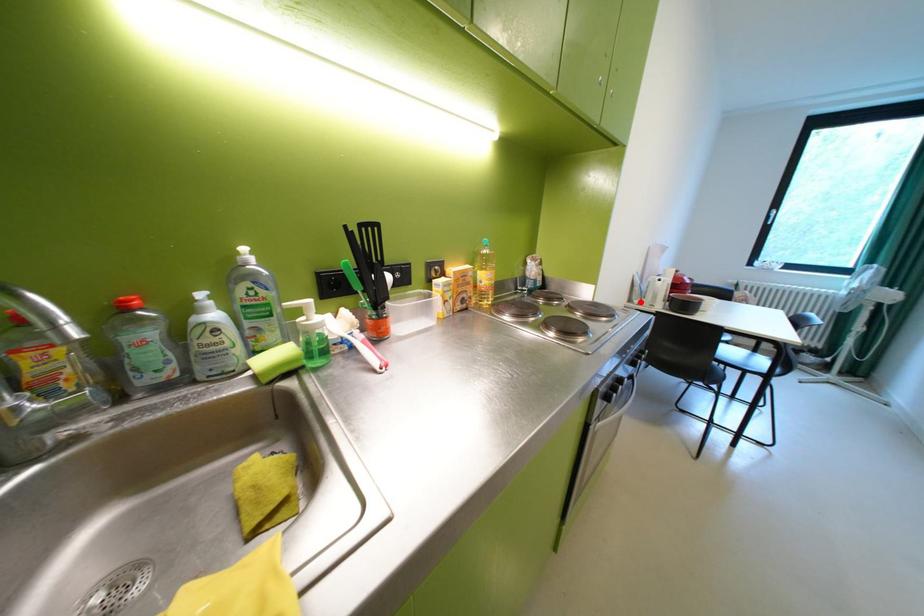
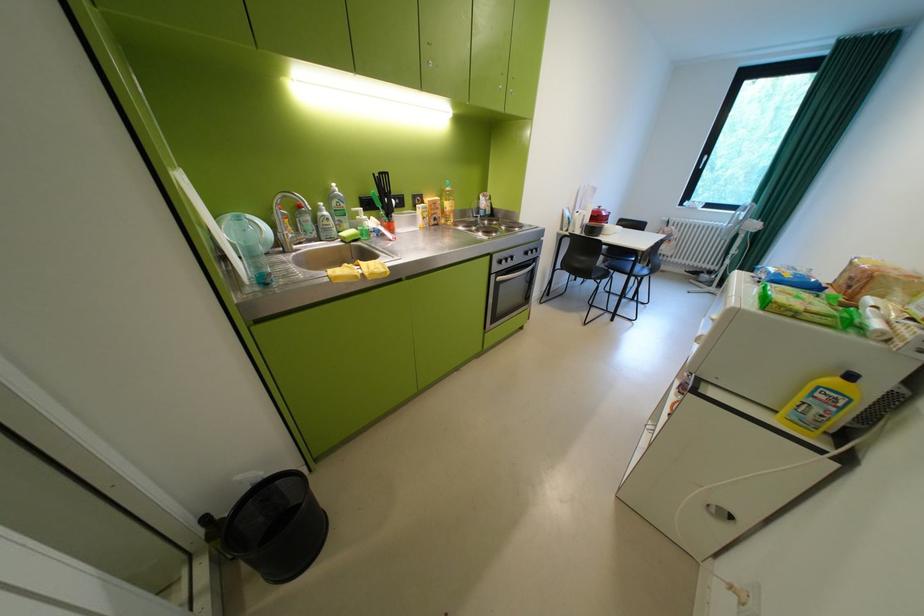
Question: I am providing you with two images of the same scene from different viewpoints. Image1 has a red point marked. In image2, the corresponding 3D location appears at what relative position? Reply with the corresponding letter.

Choices:
 (A) Closer
 (B) Farther

Answer: (A)